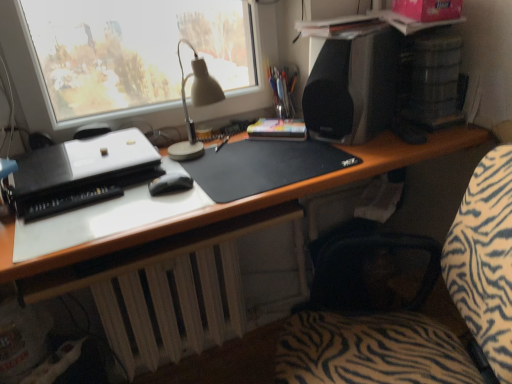
Where is `black plastic printer at left`? This screenshot has height=384, width=512. black plastic printer at left is located at coordinates (79, 172).

At what (x,y) coordinates should I click in order to perform the action: click on black matte mouse at center. Please return your answer as a coordinate pair (x, y). The width and height of the screenshot is (512, 384). Looking at the image, I should click on (170, 183).

Locate an element on the screen. Image resolution: width=512 pixels, height=384 pixels. black matte mousepad at center is located at coordinates (263, 166).

Is black matte mouse at center positioned beyond the bounds of black matte mousepad at center?

Yes, black matte mouse at center is outside of black matte mousepad at center.

Based on the photo, is black matte mouse at center closer to camera compared to black matte mousepad at center?

No, it is not.

Image resolution: width=512 pixels, height=384 pixels. Identify the location of mouse on the left of black matte mousepad at center. (170, 183).

Looking at this image, is hardcover book at center at the back of black matte mouse at center?

No, hardcover book at center is not at the back of black matte mouse at center.

From the image's perspective, which is above, black matte mouse at center or hardcover book at center?

hardcover book at center is shown above in the image.

Is hardcover book at center completely or partially inside black matte mouse at center?

No, hardcover book at center is not a part of black matte mouse at center.

From the image's perspective, between hardcover book at center and white matte radiator at lower center, who is located below?

white matte radiator at lower center appears lower in the image.

Who is more distant, hardcover book at center or white matte radiator at lower center?

hardcover book at center is behind.

Is hardcover book at center oriented towards white matte radiator at lower center?

No, hardcover book at center is not turned towards white matte radiator at lower center.

How much distance is there between hardcover book at center and white matte radiator at lower center?

hardcover book at center is 23.21 inches away from white matte radiator at lower center.

Can you confirm if black plastic printer at left is wider than black matte speaker at upper right?

Yes.

Considering the relative positions of black plastic printer at left and black matte speaker at upper right in the image provided, is black plastic printer at left in front of black matte speaker at upper right?

Yes, black plastic printer at left is closer to the camera.

Is black plastic printer at left far from black matte speaker at upper right?

They are positioned close to each other.

Which point is more distant from viewer, (39, 173) or (308, 132)?

The point (308, 132) is farther from the camera.

There is a hardcover book at center. Where is `loudspeaker above it (from a real-world perspective)`? The image size is (512, 384). loudspeaker above it (from a real-world perspective) is located at coordinates (353, 86).

Is hardcover book at center inside or outside of black matte speaker at upper right?

hardcover book at center is outside black matte speaker at upper right.

Is hardcover book at center positioned with its back to black matte speaker at upper right?

No, hardcover book at center's orientation is not away from black matte speaker at upper right.

Which of these two, black matte mousepad at center or black matte mouse at center, is thinner?

black matte mouse at center is thinner.

Is black matte mousepad at center smaller than black matte mouse at center?

No, black matte mousepad at center is not smaller than black matte mouse at center.

Is black matte mousepad at center spatially inside black matte mouse at center, or outside of it?

black matte mousepad at center lies outside black matte mouse at center.

Is black matte mouse at center at the back of black matte mousepad at center?

That's not correct — black matte mousepad at center is not looking away from black matte mouse at center.

Is white matte radiator at lower center not near black matte desk at center?

No, white matte radiator at lower center is in close proximity to black matte desk at center.

Which is behind, point (178, 355) or point (33, 261)?

The point (178, 355) is farther.

Considering the sizes of objects white matte radiator at lower center and black matte desk at center in the image provided, who is shorter, white matte radiator at lower center or black matte desk at center?

With less height is white matte radiator at lower center.

Locate an element on the screen. mouse above the black matte mousepad at center (from a real-world perspective) is located at coordinates (170, 183).

Locate an element on the screen. mouse that is under the hardcover book at center (from a real-world perspective) is located at coordinates (170, 183).

Based on the photo, based on their spatial positions, is black matte mousepad at center or black matte desk at center further from black matte mouse at center?

black matte desk at center.

When comparing their distances from black plastic printer at left, does black matte desk at center or white matte radiator at lower center seem further?

Based on the image, white matte radiator at lower center appears to be further to black plastic printer at left.

Estimate the real-world distances between objects in this image. Which object is closer to black matte speaker at upper right, zebra-patterned fabric at center or black matte desk at center?

black matte desk at center.

Looking at the image, which one is located closer to black matte mouse at center, black matte speaker at upper right or black matte desk at center?

The object closer to black matte mouse at center is black matte desk at center.

Looking at the image, which one is located further to black plastic printer at left, white matte radiator at lower center or zebra-patterned fabric at center?

The object further to black plastic printer at left is zebra-patterned fabric at center.

Estimate the real-world distances between objects in this image. Which object is further from black matte mousepad at center, metallic silver pen holder at upper center or black matte desk at center?

metallic silver pen holder at upper center.

Which object lies nearer to the anchor point black matte desk at center, metallic silver pen holder at upper center or zebra-patterned fabric at center?

zebra-patterned fabric at center lies closer to black matte desk at center than the other object.

Estimate the real-world distances between objects in this image. Which object is further from black matte mousepad at center, black plastic printer at left or black matte desk at center?

Based on the image, black plastic printer at left appears to be further to black matte mousepad at center.

This screenshot has width=512, height=384. I want to click on desk between zebra-patterned fabric at center and black matte mousepad at center along the z-axis, so click(252, 199).

This screenshot has width=512, height=384. Find the location of `desk between black matte mousepad at center and white matte radiator at lower center from top to bottom`. desk between black matte mousepad at center and white matte radiator at lower center from top to bottom is located at coordinates point(252,199).

Where is `paperback book situated between black plastic printer at left and black matte speaker at upper right from left to right`? The height and width of the screenshot is (384, 512). paperback book situated between black plastic printer at left and black matte speaker at upper right from left to right is located at coordinates (277, 129).

At what (x,y) coordinates should I click in order to perform the action: click on printer between zebra-patterned fabric at center and hardcover book at center along the z-axis. Please return your answer as a coordinate pair (x, y). Looking at the image, I should click on (79, 172).